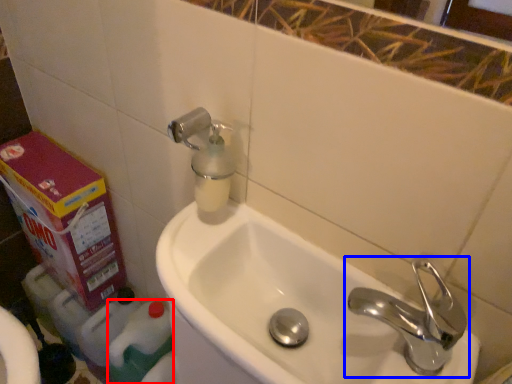
Question: Which of the following is the closest to the observer, cleaning product (highlighted by a red box) or tap (highlighted by a blue box)?

Choices:
 (A) cleaning product
 (B) tap

Answer: (B)